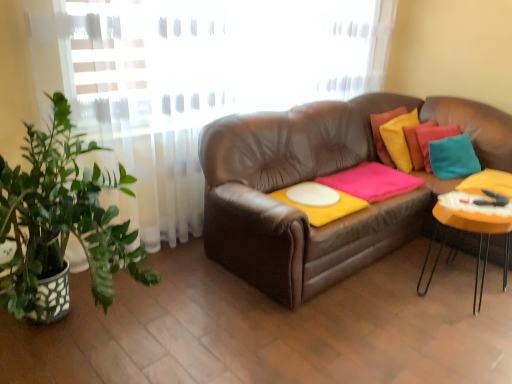
Question: Does point (488, 215) appear closer or farther from the camera than point (324, 218)?

Choices:
 (A) closer
 (B) farther

Answer: (A)

Question: Is orange matte table at right situated inside white matte round table at center or outside?

Choices:
 (A) outside
 (B) inside

Answer: (A)

Question: Which of these objects is positioned closest to the orange matte table at right?

Choices:
 (A) pink matte blanket at center
 (B) white matte round table at center

Answer: (A)

Question: Which is nearer to the white matte round table at center?

Choices:
 (A) orange matte table at right
 (B) pink matte blanket at center

Answer: (B)